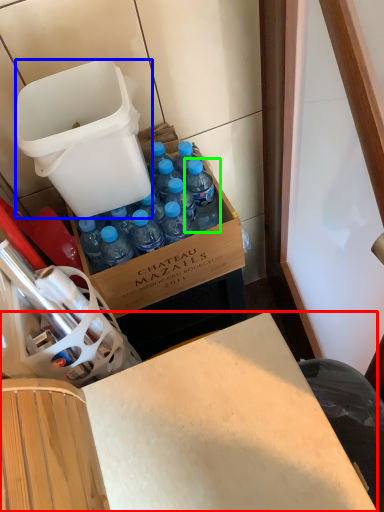
Question: Estimate the real-world distances between objects in this image. Which object is closer to desk (highlighted by a red box), trash bin/can (highlighted by a blue box) or bottle (highlighted by a green box)?

Choices:
 (A) trash bin/can
 (B) bottle

Answer: (B)